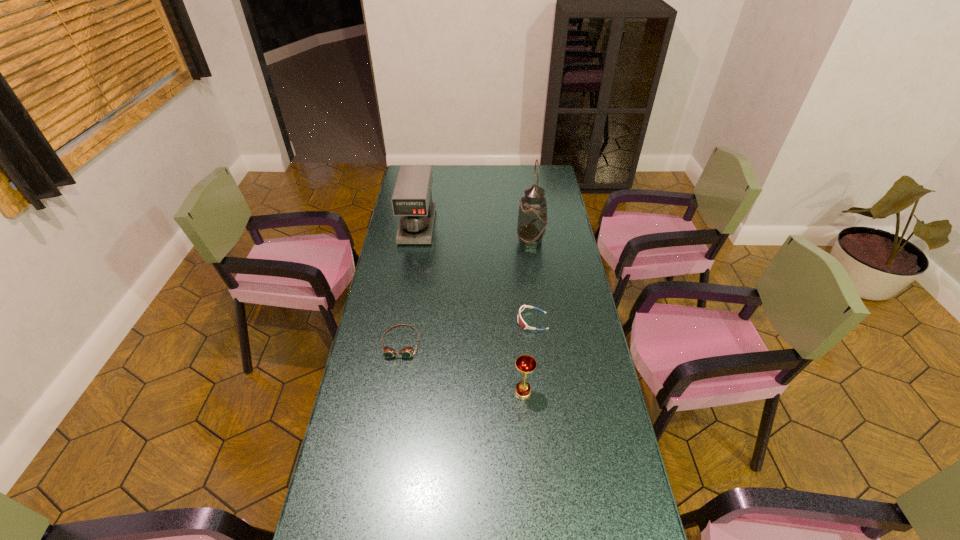
Where is `vacant space located on the front-facing side of the right goggles`? Image resolution: width=960 pixels, height=540 pixels. vacant space located on the front-facing side of the right goggles is located at coordinates (480, 321).

What are the coordinates of `vacant space positioned on the front-facing side of the right goggles` in the screenshot? It's located at (443, 321).

Where is `blank space located through the lenses of the left goggles`? blank space located through the lenses of the left goggles is located at coordinates (381, 465).

Identify the location of coffee maker that is at the left edge. (412, 197).

This screenshot has width=960, height=540. Find the location of `goggles present at the left edge`. goggles present at the left edge is located at coordinates (406, 352).

Image resolution: width=960 pixels, height=540 pixels. Identify the location of object that is positioned at the right edge. (532, 219).

Locate an element on the screen. free space at the far edge of the desktop is located at coordinates (475, 169).

The height and width of the screenshot is (540, 960). I want to click on vacant space at the right edge of the desktop, so click(603, 433).

Identify the location of empty space between the fourth shortest object and the tallest object. This screenshot has width=960, height=540. (474, 234).

Identify the location of free point between the left goggles and the second tallest object. (409, 285).